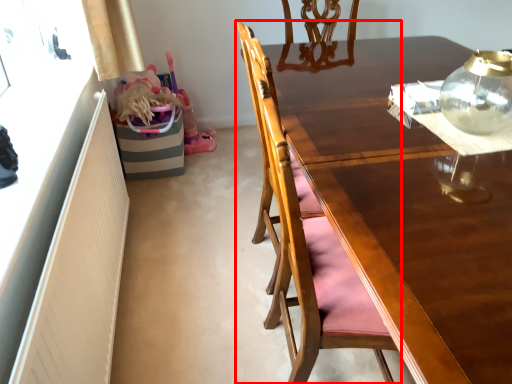
Question: Considering the relative positions of chair (annotated by the red box) and tea pot in the image provided, where is chair (annotated by the red box) located with respect to the staircase?

Choices:
 (A) left
 (B) right

Answer: (A)